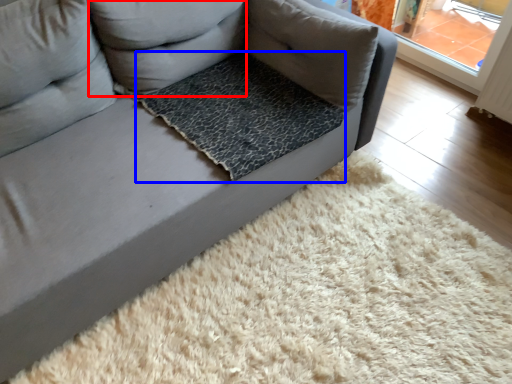
Question: Among these objects, which one is nearest to the camera, pillow (highlighted by a red box) or dog bed (highlighted by a blue box)?

Choices:
 (A) pillow
 (B) dog bed

Answer: (A)